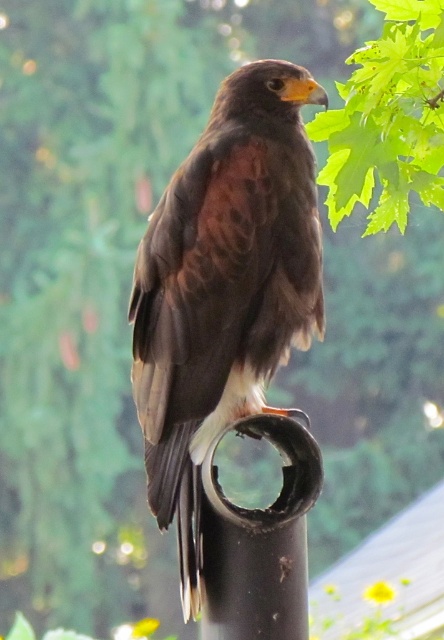
Question: Where is brown feathered eagle at center located in relation to black matte pipe at center in the image?

Choices:
 (A) right
 (B) left

Answer: (B)

Question: Does brown feathered eagle at center appear on the left side of black matte pipe at center?

Choices:
 (A) no
 (B) yes

Answer: (B)

Question: Which of the following is the farthest from the observer?

Choices:
 (A) (191, 276)
 (B) (210, 506)

Answer: (B)

Question: Can you confirm if brown feathered eagle at center is positioned to the left of black matte pipe at center?

Choices:
 (A) yes
 (B) no

Answer: (A)